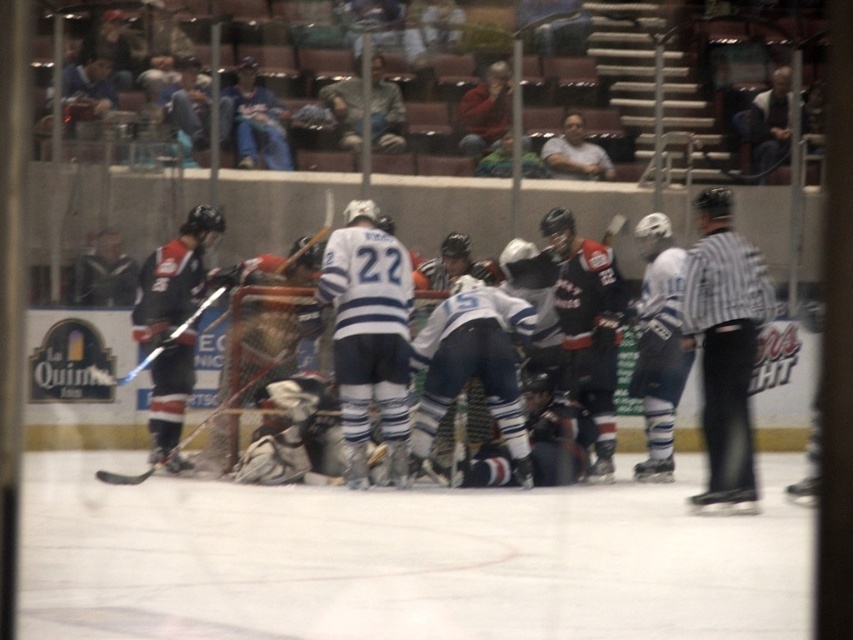
Does black striped shirt at right have a larger size compared to white jersey at center?

Yes.

Between point (741, 349) and point (612, 234), which one is positioned behind?

The point (612, 234) is more distant.

The image size is (853, 640). What do you see at coordinates (724, 346) in the screenshot?
I see `black striped shirt at right` at bounding box center [724, 346].

The height and width of the screenshot is (640, 853). In order to click on black striped shirt at right in this screenshot , I will do `click(724, 346)`.

Is black striped shirt at right taller than shiny blue hockey stick at left?

Correct, black striped shirt at right is much taller as shiny blue hockey stick at left.

Which is more to the right, black striped shirt at right or shiny blue hockey stick at left?

Positioned to the right is black striped shirt at right.

Between point (717, 234) and point (215, 321), which one is positioned in front?

Positioned in front is point (717, 234).

Locate an element on the screen. black striped shirt at right is located at coordinates (724, 346).

Which is below, matte black jersey at left or shiny blue hockey stick at left?

matte black jersey at left

Which is more to the left, matte black jersey at left or shiny blue hockey stick at left?

matte black jersey at left

Between point (165, 278) and point (149, 356), which one is positioned behind?

Point (165, 278)

Locate an element on the screen. The image size is (853, 640). matte black jersey at left is located at coordinates (172, 326).